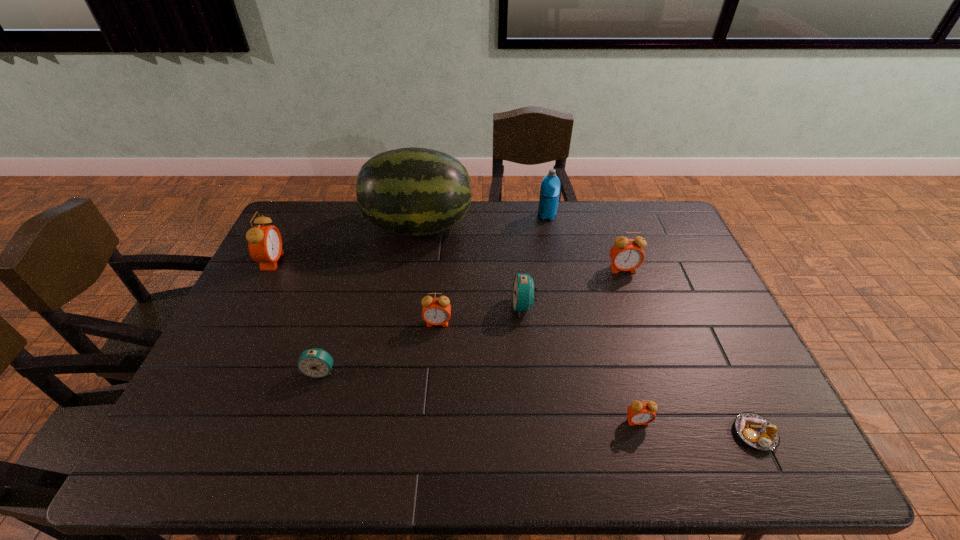
Where is `pink alarm clock that is the second closest to the tallest alarm clock`? The image size is (960, 540). pink alarm clock that is the second closest to the tallest alarm clock is located at coordinates (626, 254).

The height and width of the screenshot is (540, 960). What are the coordinates of `pink alarm clock that can be found as the third closest to the bigger blue alarm clock` in the screenshot? It's located at (640, 413).

I want to click on free space in the image that satisfies the following two spatial constraints: 1. on the front-facing side of the brown pastry; 2. on the left side of the left blue alarm clock, so click(x=301, y=434).

Locate an element on the screen. The width and height of the screenshot is (960, 540). blank space that satisfies the following two spatial constraints: 1. on the front side of the watermelon; 2. on the face of the leftmost alarm clock is located at coordinates (413, 261).